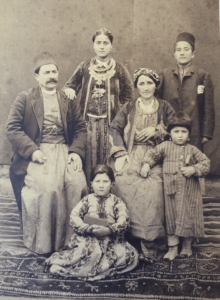
Where is `coat`? This screenshot has height=300, width=220. coat is located at coordinates (27, 125), (171, 112), (185, 89).